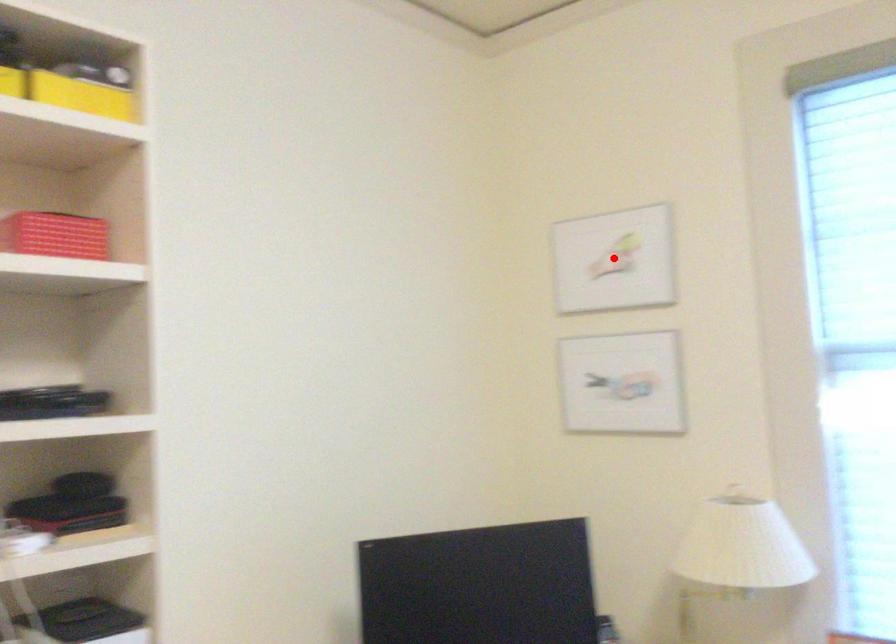
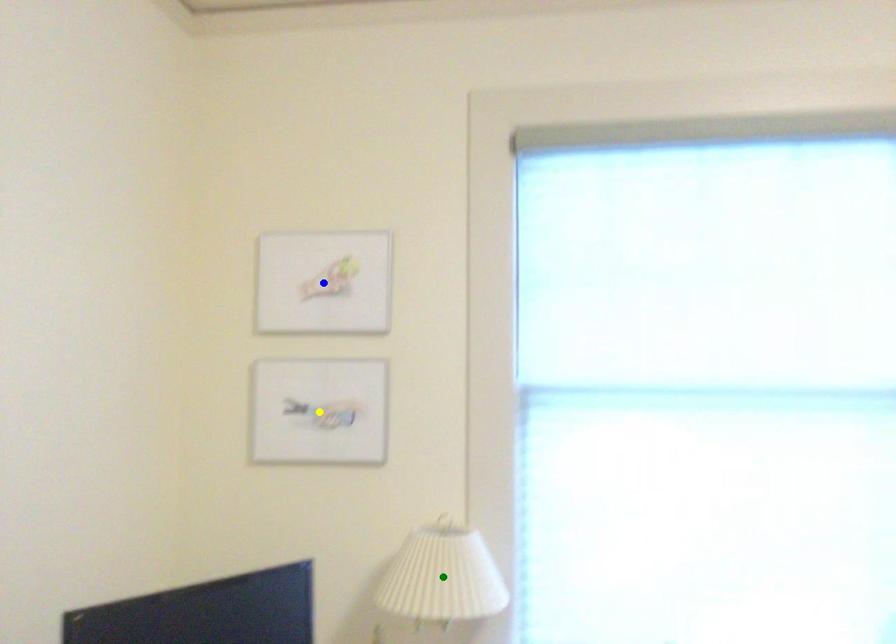
Question: I am providing you with two images of the same scene from different viewpoints. A red point is marked on the first image. You are given multiple points on the second image. In image 2, which mark is for the same physical point as the one in image 1?

Choices:
 (A) green point
 (B) blue point
 (C) yellow point

Answer: (B)